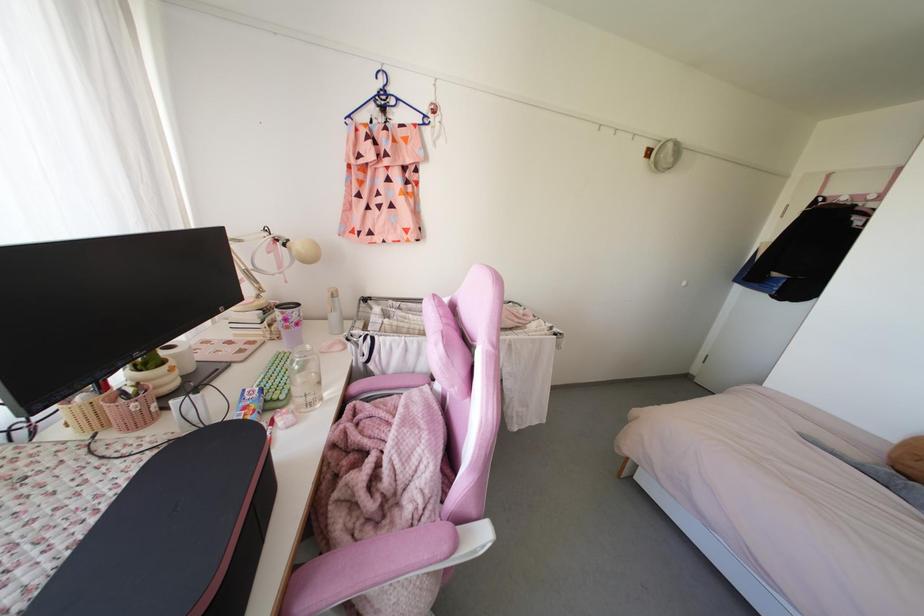
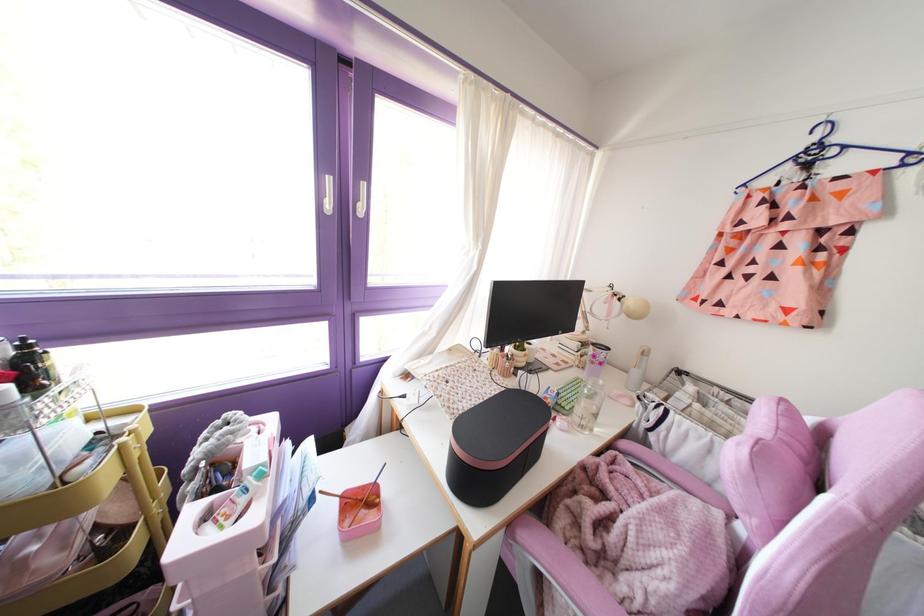
Locate, in the second image, the point that corresponds to (x=333, y=315) in the first image.

(634, 371)